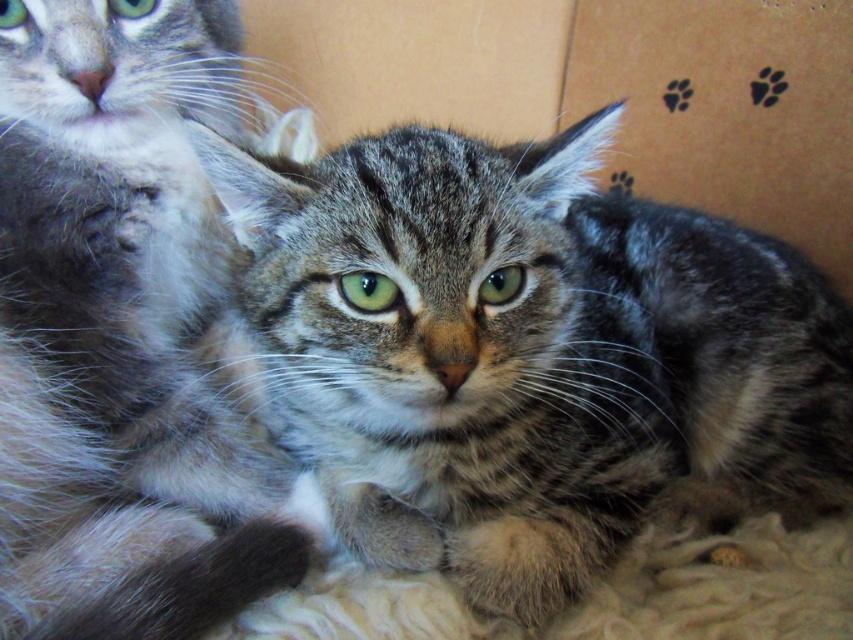
Can you confirm if tabby fur cat at center is positioned to the left of soft gray fur cat at upper left?

In fact, tabby fur cat at center is to the right of soft gray fur cat at upper left.

Does tabby fur cat at center lie in front of soft gray fur cat at upper left?

No, tabby fur cat at center is behind soft gray fur cat at upper left.

Is point (492, 412) more distant than point (114, 497)?

That is False.

Where is `tabby fur cat at center`? This screenshot has width=853, height=640. tabby fur cat at center is located at coordinates (527, 355).

Who is positioned more to the left, tabby fur cat at center or cardboard at center?

From the viewer's perspective, cardboard at center appears more on the left side.

From the picture: Does tabby fur cat at center have a larger size compared to cardboard at center?

Yes, tabby fur cat at center is bigger than cardboard at center.

Locate an element on the screen. The width and height of the screenshot is (853, 640). tabby fur cat at center is located at coordinates (527, 355).

Is soft gray fur cat at upper left to the right of cardboard at center from the viewer's perspective?

Incorrect, soft gray fur cat at upper left is not on the right side of cardboard at center.

Is the position of soft gray fur cat at upper left more distant than that of cardboard at center?

No, soft gray fur cat at upper left is closer to the viewer.

Is point (39, 160) behind point (842, 102)?

No, (39, 160) is closer to viewer.

The image size is (853, 640). What are the coordinates of `soft gray fur cat at upper left` in the screenshot? It's located at (117, 330).